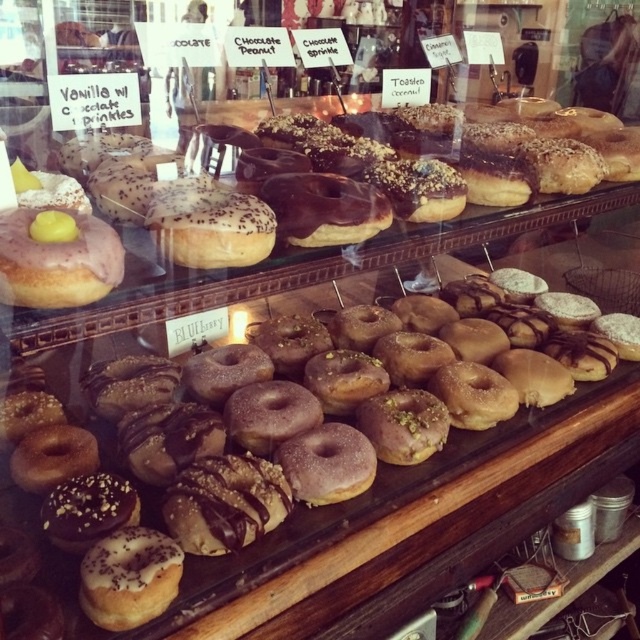
Is matte white glazed donut at left to the left of matte pink glazed donut at left from the viewer's perspective?

No, matte white glazed donut at left is not to the left of matte pink glazed donut at left.

Between matte white glazed donut at left and matte pink glazed donut at left, which one is positioned higher?

Positioned higher is matte white glazed donut at left.

What do you see at coordinates (355, 244) in the screenshot?
I see `matte white glazed donut at left` at bounding box center [355, 244].

At what (x,y) coordinates should I click in order to perform the action: click on matte white glazed donut at left. Please return your answer as a coordinate pair (x, y). This screenshot has width=640, height=640. Looking at the image, I should click on (355, 244).

Between point (272, 545) and point (280, 244), which one is positioned in front?

Positioned in front is point (272, 545).

Is chocolate glaze donut at center above matte white glazed donut at left?

Actually, chocolate glaze donut at center is below matte white glazed donut at left.

Where is `chocolate glaze donut at center`? Image resolution: width=640 pixels, height=640 pixels. chocolate glaze donut at center is located at coordinates (320, 488).

This screenshot has height=640, width=640. Describe the element at coordinates (320, 488) in the screenshot. I see `chocolate glaze donut at center` at that location.

Is point (556, 410) less distant than point (83, 218)?

No, (556, 410) is further to viewer.

The height and width of the screenshot is (640, 640). Find the location of `chocolate glaze donut at center`. chocolate glaze donut at center is located at coordinates (320, 488).